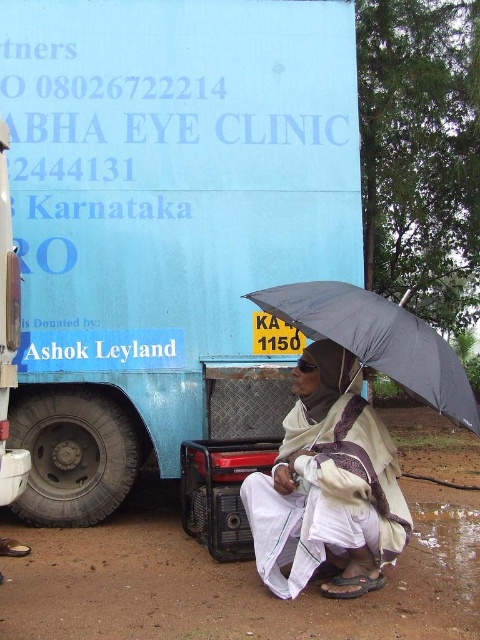
Question: Does blue matte truck at center come behind white cotton robe at lower center?

Choices:
 (A) yes
 (B) no

Answer: (A)

Question: Which of these objects is positioned closest to the white cotton robe at lower center?

Choices:
 (A) blue matte truck at center
 (B) black matte umbrella at lower right

Answer: (B)

Question: Considering the real-world distances, which object is closest to the white cotton robe at lower center?

Choices:
 (A) blue matte truck at center
 (B) black matte umbrella at lower right

Answer: (B)

Question: Estimate the real-world distances between objects in this image. Which object is closer to the white cotton robe at lower center?

Choices:
 (A) black matte umbrella at lower right
 (B) blue matte truck at center

Answer: (A)

Question: Does white cotton robe at lower center appear under black matte umbrella at lower right?

Choices:
 (A) no
 (B) yes

Answer: (B)

Question: Is the position of white cotton robe at lower center more distant than that of black matte umbrella at lower right?

Choices:
 (A) no
 (B) yes

Answer: (B)